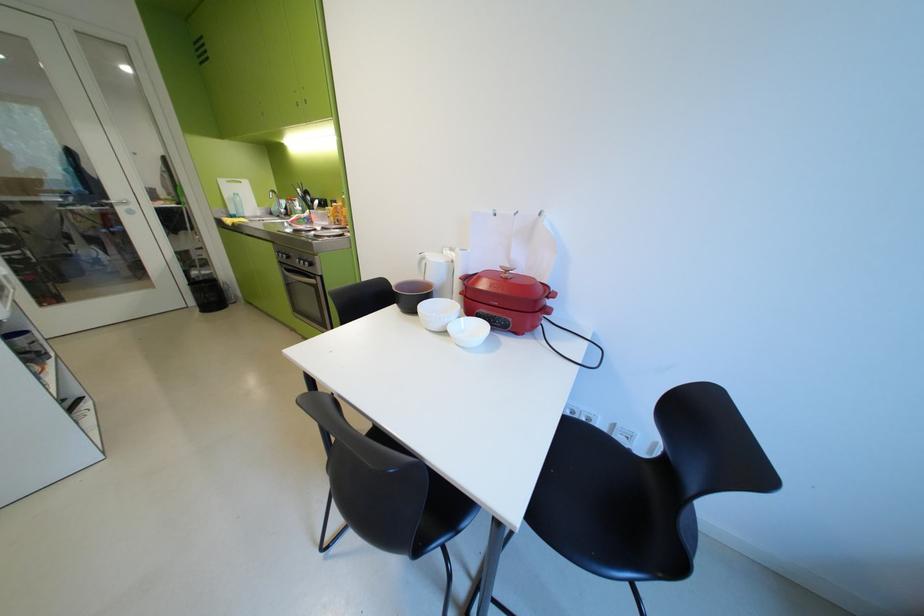
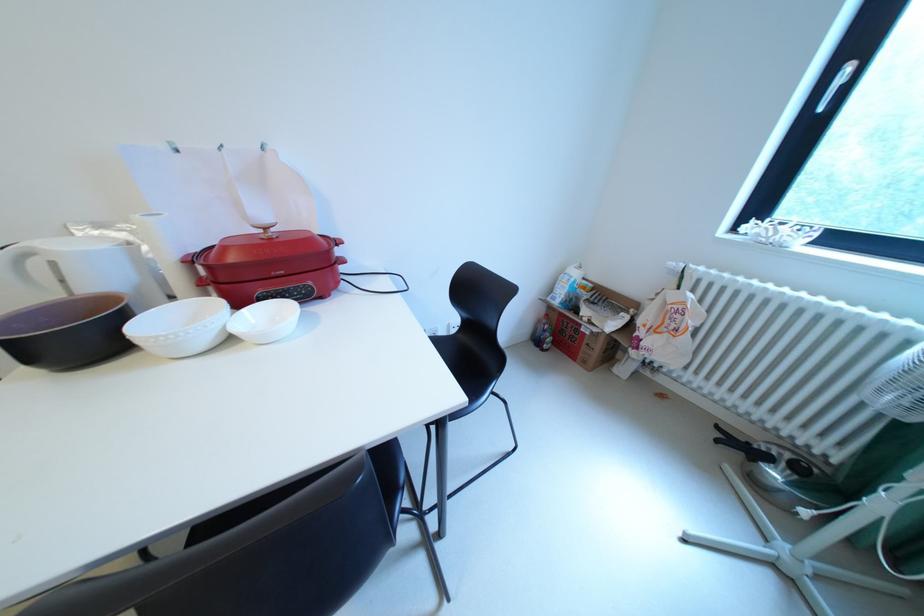
Where in the second image is the point corresponding to point 514,276 from the first image?

(273, 237)